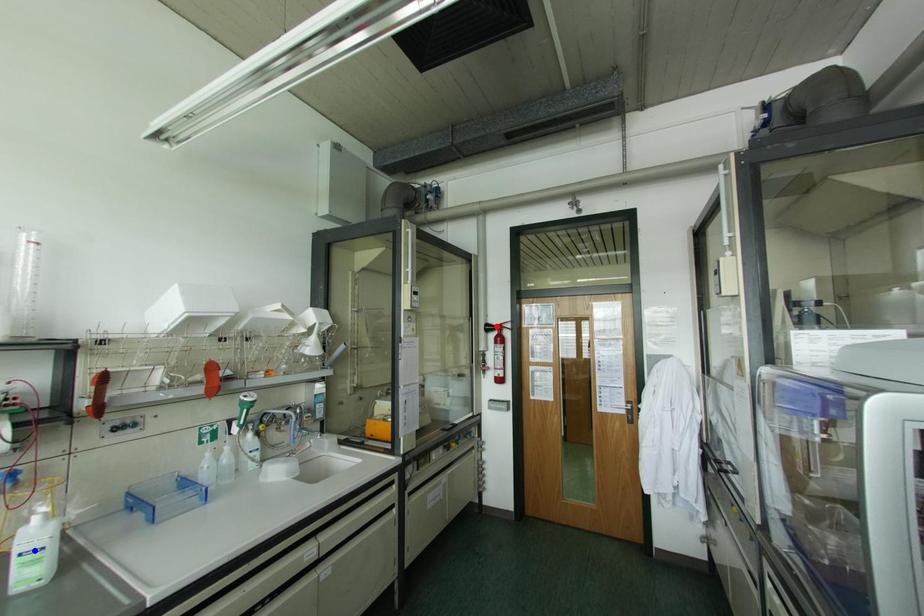
Question: Which of the two points in the image is closer to the camera?

Choices:
 (A) Blue point is closer.
 (B) Red point is closer.

Answer: (A)